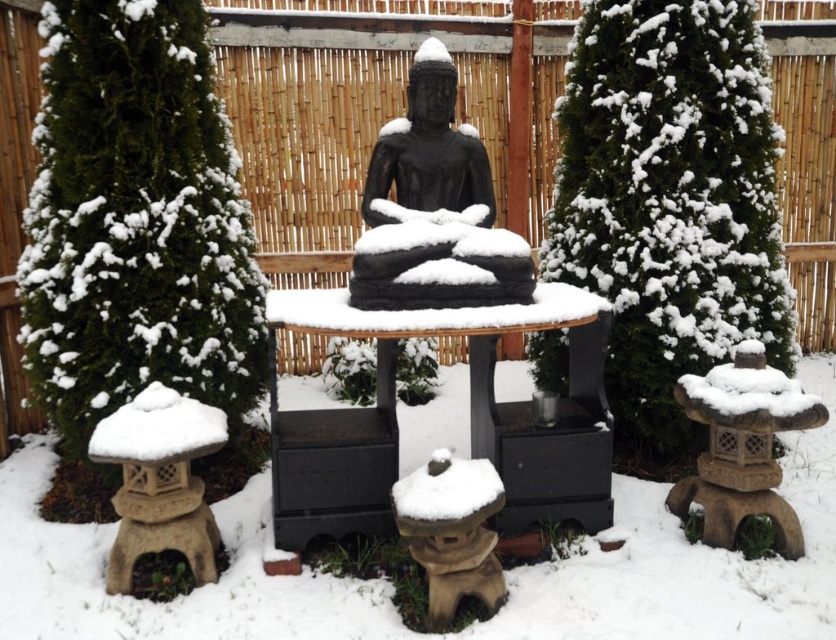
Question: In this image, where is black matte table at center located relative to black stone statue at center?

Choices:
 (A) below
 (B) above

Answer: (A)

Question: Which point is farther to the camera?

Choices:
 (A) black stone statue at center
 (B) black matte table at center

Answer: (A)

Question: Among these objects, which one is nearest to the camera?

Choices:
 (A) black stone statue at center
 (B) black matte table at center

Answer: (B)

Question: Is black matte table at center to the right of black stone statue at center from the viewer's perspective?

Choices:
 (A) no
 (B) yes

Answer: (B)

Question: Can you confirm if black matte table at center is wider than black stone statue at center?

Choices:
 (A) no
 (B) yes

Answer: (B)